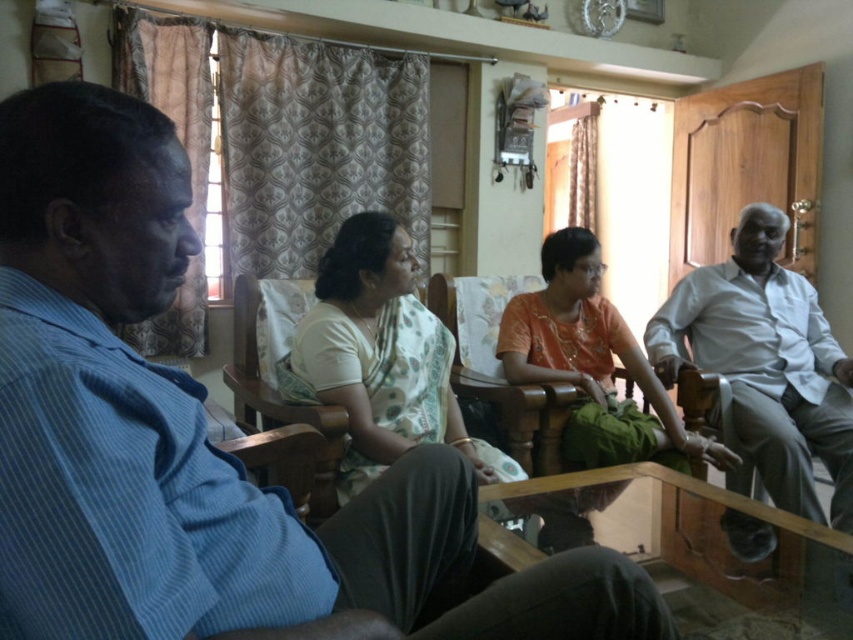
Between point (676, 356) and point (381, 326), which one is positioned behind?

The point (676, 356) is behind.

Between white cotton shirt at right and white cotton saree at center, which one is positioned higher?

Positioned higher is white cotton saree at center.

You are a GUI agent. You are given a task and a screenshot of the screen. Output one action in this format:
    pyautogui.click(x=<x>, y=<y>)
    Task: Click on the white cotton shirt at right
    The image size is (853, 640).
    Given the screenshot: What is the action you would take?
    coord(766,364)

Is the position of blue striped shirt at left less distant than that of orange fabric dress at center?

Yes, blue striped shirt at left is closer to the viewer.

Consider the image. Can you confirm if blue striped shirt at left is thinner than orange fabric dress at center?

No, blue striped shirt at left is not thinner than orange fabric dress at center.

Who is more forward, (73, 381) or (532, 337)?

Positioned in front is point (73, 381).

The image size is (853, 640). I want to click on blue striped shirt at left, so (201, 438).

Find the location of a particular element. white cotton shirt at right is located at coordinates (766, 364).

The width and height of the screenshot is (853, 640). In order to click on white cotton shirt at right in this screenshot , I will do [766, 364].